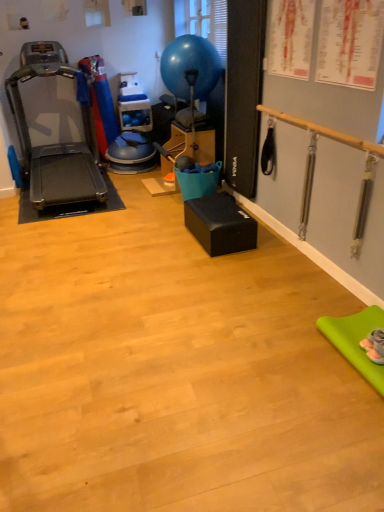
The width and height of the screenshot is (384, 512). I want to click on blue rubber balloon at upper center, so click(x=190, y=67).

What do you see at coordinates (190, 67) in the screenshot? The height and width of the screenshot is (512, 384). I see `blue rubber balloon at upper center` at bounding box center [190, 67].

This screenshot has height=512, width=384. In order to click on metallic gray treadmill at left in this screenshot , I will do `click(54, 144)`.

Describe the element at coordinates (54, 144) in the screenshot. The image size is (384, 512). I see `metallic gray treadmill at left` at that location.

Where is `blue rubber balloon at upper center`? This screenshot has width=384, height=512. blue rubber balloon at upper center is located at coordinates (190, 67).

Between blue rubber balloon at upper center and metallic gray treadmill at left, which one appears on the left side from the viewer's perspective?

metallic gray treadmill at left.

Is blue rubber balloon at upper center further to the viewer compared to metallic gray treadmill at left?

Yes, blue rubber balloon at upper center is behind metallic gray treadmill at left.

Which is nearer, (188, 47) or (78, 144)?

The point (188, 47) is in front.

From the image's perspective, which is below, blue rubber balloon at upper center or metallic gray treadmill at left?

metallic gray treadmill at left, from the image's perspective.

From a real-world perspective, which is physically above, blue rubber balloon at upper center or metallic gray treadmill at left?

blue rubber balloon at upper center is physically above.

Which object is thinner, blue rubber balloon at upper center or metallic gray treadmill at left?

Thinner between the two is blue rubber balloon at upper center.

Considering the relative sizes of blue rubber balloon at upper center and metallic gray treadmill at left in the image provided, is blue rubber balloon at upper center taller than metallic gray treadmill at left?

Incorrect, the height of blue rubber balloon at upper center is not larger of that of metallic gray treadmill at left.

In the scene shown: Between blue rubber balloon at upper center and metallic gray treadmill at left, which one has larger size?

metallic gray treadmill at left is bigger.

Is blue rubber balloon at upper center situated inside metallic gray treadmill at left or outside?

blue rubber balloon at upper center is outside metallic gray treadmill at left.

Is the surface of blue rubber balloon at upper center in direct contact with metallic gray treadmill at left?

No.

Is metallic gray treadmill at left at the back of blue rubber balloon at upper center?

No, blue rubber balloon at upper center is not facing the opposite direction of metallic gray treadmill at left.

How many degrees apart are the facing directions of blue rubber balloon at upper center and metallic gray treadmill at left?

They differ by 89.5 degrees in their facing directions.

Where is `treadmill that appears on the left of blue rubber balloon at upper center`? treadmill that appears on the left of blue rubber balloon at upper center is located at coordinates (54, 144).

Is metallic gray treadmill at left to the left of blue rubber balloon at upper center from the viewer's perspective?

Indeed, metallic gray treadmill at left is positioned on the left side of blue rubber balloon at upper center.

Between metallic gray treadmill at left and blue rubber balloon at upper center, which one is positioned in front?

metallic gray treadmill at left is in front.

Does point (101, 194) come in front of point (203, 91)?

No, (101, 194) is further to viewer.

From the image's perspective, which is below, metallic gray treadmill at left or blue rubber balloon at upper center?

From the image's view, metallic gray treadmill at left is below.

From a real-world perspective, between metallic gray treadmill at left and blue rubber balloon at upper center, who is vertically higher?

From a 3D spatial view, blue rubber balloon at upper center is above.

Between metallic gray treadmill at left and blue rubber balloon at upper center, which one has larger width?

With larger width is metallic gray treadmill at left.

Between metallic gray treadmill at left and blue rubber balloon at upper center, which one has more height?

metallic gray treadmill at left.

Looking at the image, does metallic gray treadmill at left seem bigger or smaller compared to blue rubber balloon at upper center?

Clearly, metallic gray treadmill at left is larger in size than blue rubber balloon at upper center.

Is metallic gray treadmill at left not inside blue rubber balloon at upper center?

Indeed, metallic gray treadmill at left is completely outside blue rubber balloon at upper center.

Is metallic gray treadmill at left not near blue rubber balloon at upper center?

Yes, metallic gray treadmill at left and blue rubber balloon at upper center are located far from each other.

Is metallic gray treadmill at left turned away from blue rubber balloon at upper center?

That's not correct — metallic gray treadmill at left is not looking away from blue rubber balloon at upper center.

How different are the orientations of metallic gray treadmill at left and blue rubber balloon at upper center in degrees?

The angle between the facing direction of metallic gray treadmill at left and the facing direction of blue rubber balloon at upper center is 89.5 degrees.

Locate an element on the screen. balloon located on the right of metallic gray treadmill at left is located at coordinates (190, 67).

Locate an element on the screen. The width and height of the screenshot is (384, 512). balloon above the metallic gray treadmill at left (from a real-world perspective) is located at coordinates (190, 67).

The height and width of the screenshot is (512, 384). What are the coordinates of `treadmill that appears in front of the blue rubber balloon at upper center` in the screenshot? It's located at (54, 144).